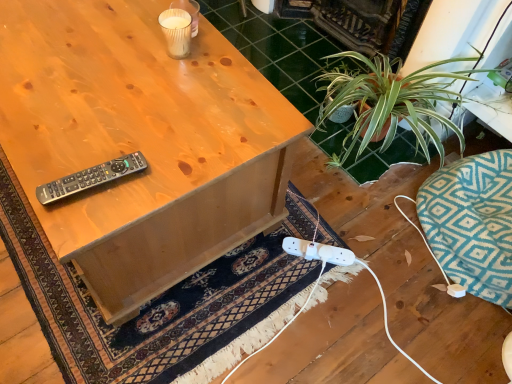
I want to click on free space to the right of black plastic remote at upper left, so click(x=163, y=173).